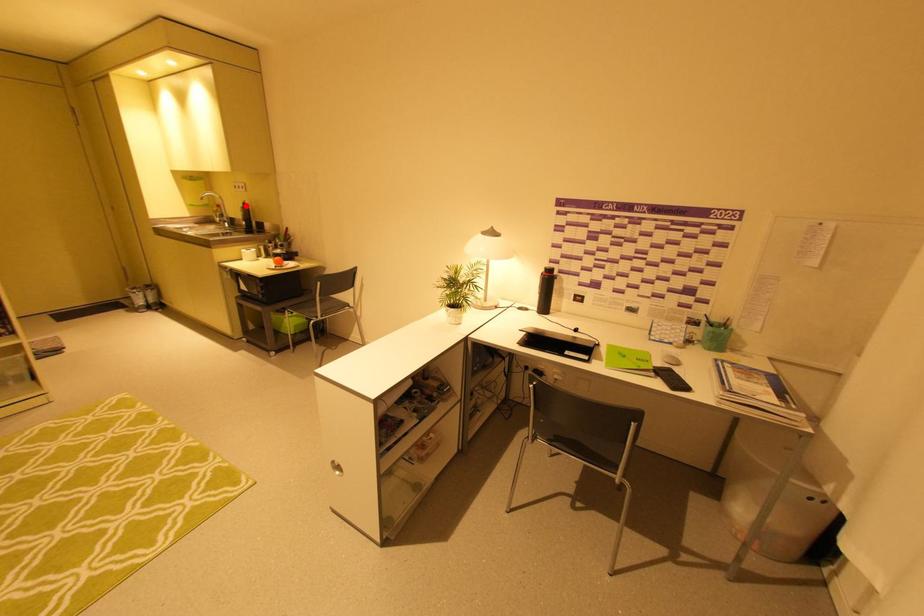
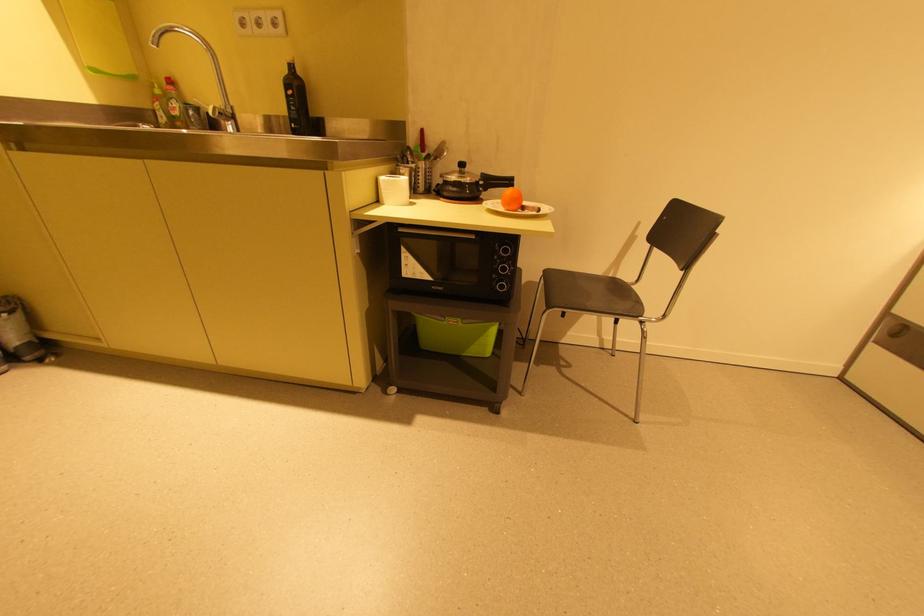
Locate, in the second image, the point that corresponds to the highlighted location in the first image.

(289, 71)